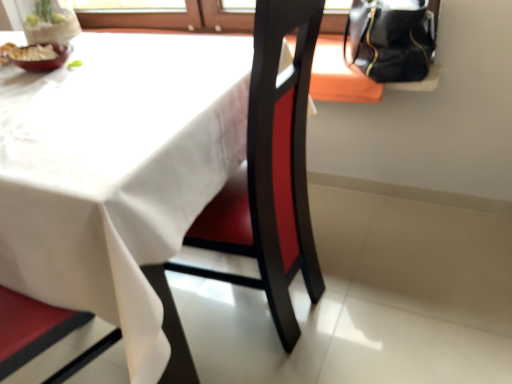
Question: Is white matte table at center in contact with matte ceramic bowl at upper left?

Choices:
 (A) no
 (B) yes

Answer: (A)

Question: From the image's perspective, would you say white matte table at center is shown under matte ceramic bowl at upper left?

Choices:
 (A) no
 (B) yes

Answer: (B)

Question: Is the position of white matte table at center more distant than that of matte ceramic bowl at upper left?

Choices:
 (A) no
 (B) yes

Answer: (A)

Question: Is there a large distance between white matte table at center and matte ceramic bowl at upper left?

Choices:
 (A) yes
 (B) no

Answer: (B)

Question: Is white matte table at center turned away from matte ceramic bowl at upper left?

Choices:
 (A) yes
 (B) no

Answer: (B)

Question: From the image's perspective, relative to matte ceramic bowl at upper left, is black leather handbag at upper right above or below?

Choices:
 (A) above
 (B) below

Answer: (A)

Question: In terms of height, does black leather handbag at upper right look taller or shorter compared to matte ceramic bowl at upper left?

Choices:
 (A) tall
 (B) short

Answer: (A)

Question: Is point (389, 1) positioned closer to the camera than point (53, 48)?

Choices:
 (A) farther
 (B) closer

Answer: (A)

Question: From a real-world perspective, is black leather handbag at upper right above or below matte ceramic bowl at upper left?

Choices:
 (A) above
 (B) below

Answer: (B)

Question: Looking at their shapes, would you say matte ceramic bowl at upper left is wider or thinner than black leather handbag at upper right?

Choices:
 (A) wide
 (B) thin

Answer: (B)

Question: Looking at the image, does matte ceramic bowl at upper left seem bigger or smaller compared to black leather handbag at upper right?

Choices:
 (A) big
 (B) small

Answer: (B)

Question: Is matte ceramic bowl at upper left inside or outside of black leather handbag at upper right?

Choices:
 (A) outside
 (B) inside

Answer: (A)

Question: Is point (49, 44) closer or farther from the camera than point (425, 56)?

Choices:
 (A) closer
 (B) farther

Answer: (A)

Question: From the image's perspective, is black leather handbag at upper right located above or below white matte table at center?

Choices:
 (A) above
 (B) below

Answer: (A)

Question: Looking at their shapes, would you say black leather handbag at upper right is wider or thinner than white matte table at center?

Choices:
 (A) thin
 (B) wide

Answer: (A)